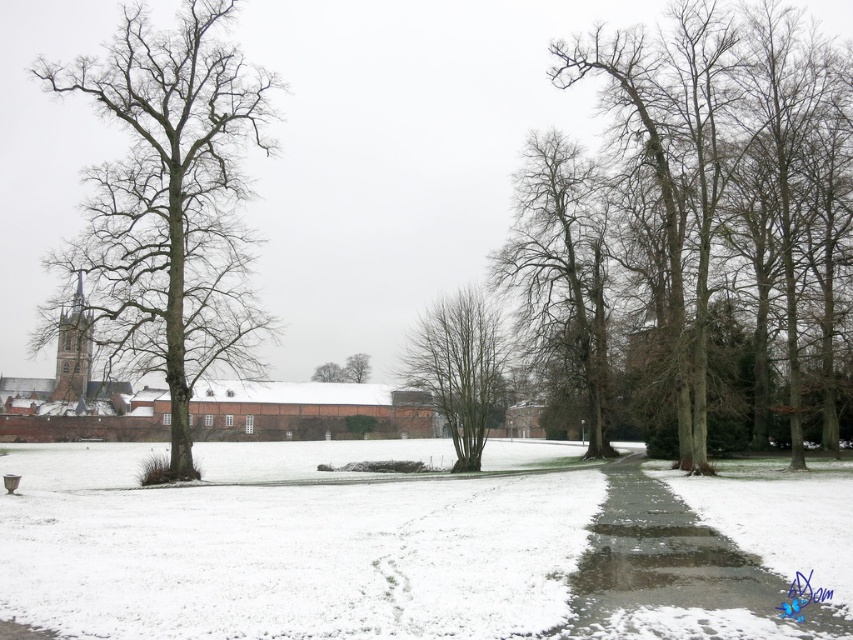
You are a GUI agent. You are given a task and a screenshot of the screen. Output one action in this format:
    pyautogui.click(x=<x>, y=<y>)
    Task: Click on the white powdery snow at center
    
    Given the screenshot: What is the action you would take?
    pyautogui.click(x=381, y=547)

Who is positioned more to the right, white powdery snow at center or smooth brown tree trunk at center?

white powdery snow at center is more to the right.

The image size is (853, 640). Find the location of `white powdery snow at center`. white powdery snow at center is located at coordinates (381, 547).

Consider the image. Between white powdery snow at center and green textured tree at center, which one has less height?

Standing shorter between the two is white powdery snow at center.

Does white powdery snow at center have a lesser height compared to green textured tree at center?

Correct, white powdery snow at center is not as tall as green textured tree at center.

Between point (74, 634) and point (451, 328), which one is positioned in front?

Point (74, 634)

At what (x,y) coordinates should I click in order to perform the action: click on white powdery snow at center. Please return your answer as a coordinate pair (x, y). The height and width of the screenshot is (640, 853). Looking at the image, I should click on tap(381, 547).

Between white powdery snow at center and bare wood tree at left, which one has less height?

With less height is white powdery snow at center.

Based on the photo, is white powdery snow at center further to the viewer compared to bare wood tree at left?

No, white powdery snow at center is in front of bare wood tree at left.

This screenshot has height=640, width=853. Find the location of `white powdery snow at center`. white powdery snow at center is located at coordinates (381, 547).

You are a GUI agent. You are given a task and a screenshot of the screen. Output one action in this format:
    pyautogui.click(x=<x>, y=<y>)
    Task: Click on the white powdery snow at center
    The image size is (853, 640).
    Given the screenshot: What is the action you would take?
    pyautogui.click(x=381, y=547)